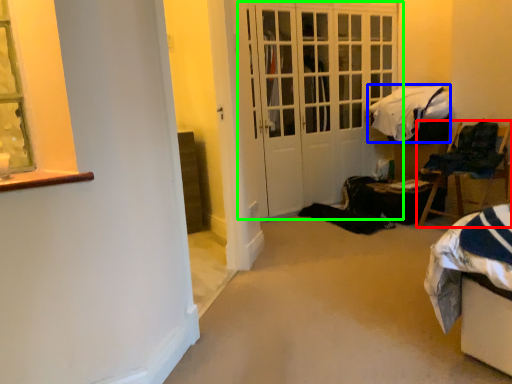
Question: Based on their relative distances, which object is farther from chair (highlighted by a red box)? Choose from blanket (highlighted by a blue box) and door (highlighted by a green box).

Choices:
 (A) blanket
 (B) door

Answer: (B)